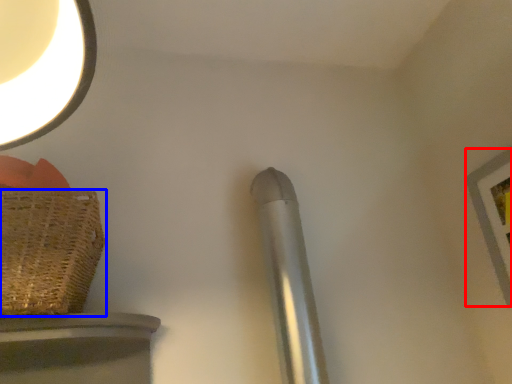
Question: Which of the following is the farthest to the observer, picture frame (highlighted by a red box) or basket (highlighted by a blue box)?

Choices:
 (A) picture frame
 (B) basket

Answer: (A)